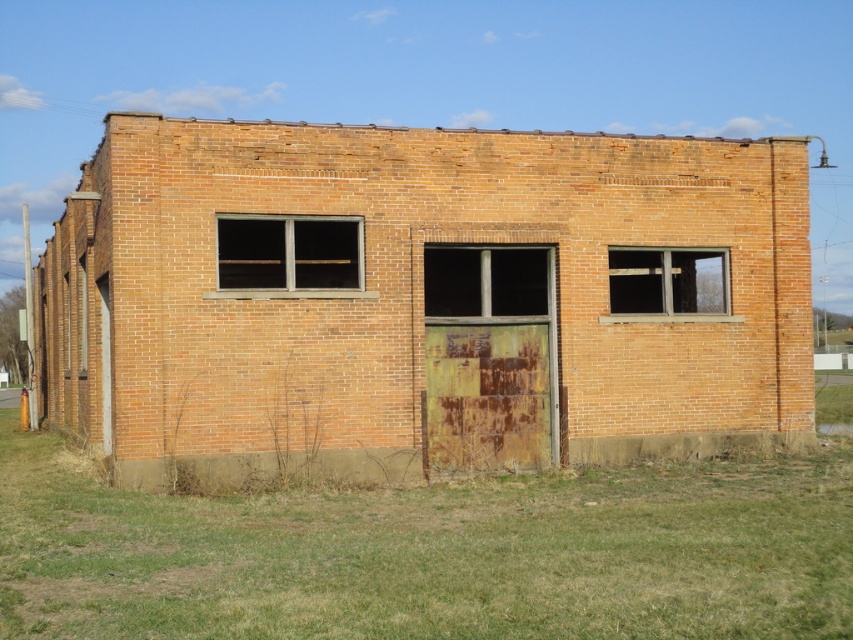
Question: Is green grass at lower center bigger than matte gray window at center right?

Choices:
 (A) yes
 (B) no

Answer: (A)

Question: Is green grass at lower center smaller than matte gray window at center right?

Choices:
 (A) no
 (B) yes

Answer: (A)

Question: Among these points, which one is farthest from the camera?

Choices:
 (A) (479, 509)
 (B) (688, 250)
 (C) (254, 272)

Answer: (B)

Question: Which point is closer to the camera?

Choices:
 (A) (635, 276)
 (B) (294, 269)
 (C) (418, 532)

Answer: (C)

Question: Is clear glass window at center positioned in front of matte gray window at center right?

Choices:
 (A) no
 (B) yes

Answer: (B)

Question: Which is nearer to the clear glass window at center?

Choices:
 (A) green grass at lower center
 (B) matte gray window at center right

Answer: (A)